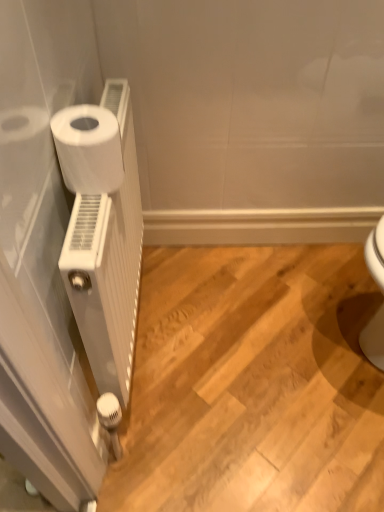
Question: Is white matte radiator at left taller or shorter than white matte radiator at left?

Choices:
 (A) tall
 (B) short

Answer: (B)

Question: From a real-world perspective, is white matte radiator at left above or below white matte radiator at left?

Choices:
 (A) above
 (B) below

Answer: (B)

Question: Estimate the real-world distances between objects in this image. Which object is farther from the white matte toilet paper at left?

Choices:
 (A) white matte radiator at left
 (B) white matte radiator at left

Answer: (A)

Question: Which of these objects is positioned closest to the white matte radiator at left?

Choices:
 (A) white matte radiator at left
 (B) white matte toilet paper at left

Answer: (A)